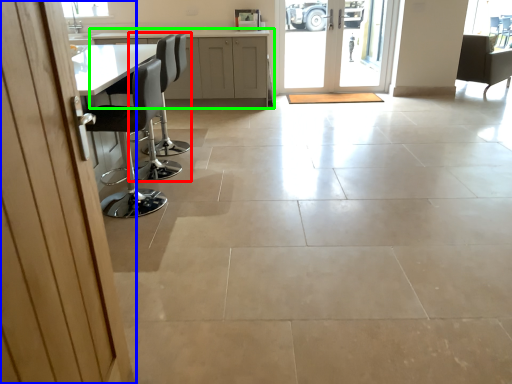
Question: Considering the real-world distances, which object is farthest from chair (highlighted by a red box)? door (highlighted by a blue box) or cabinetry (highlighted by a green box)?

Choices:
 (A) door
 (B) cabinetry

Answer: (A)